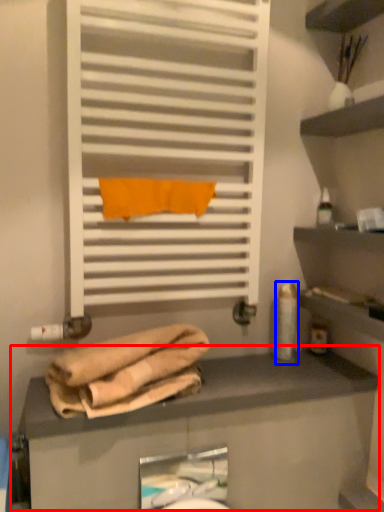
Question: Which point is closer to the camera, counter (highlighted by a red box) or toiletry (highlighted by a blue box)?

Choices:
 (A) counter
 (B) toiletry

Answer: (A)